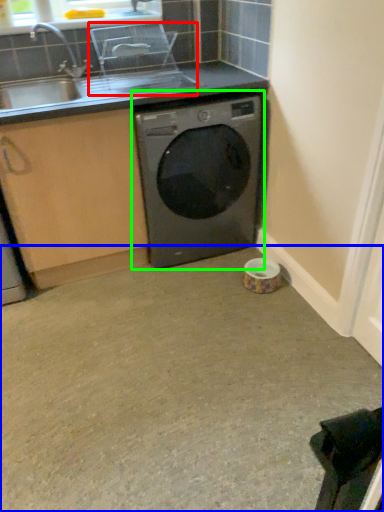
Question: Which object is positioned closest to appliance (highlighted by a red box)? Select from concrete (highlighted by a blue box) and washing machine (highlighted by a green box).

Choices:
 (A) concrete
 (B) washing machine

Answer: (B)